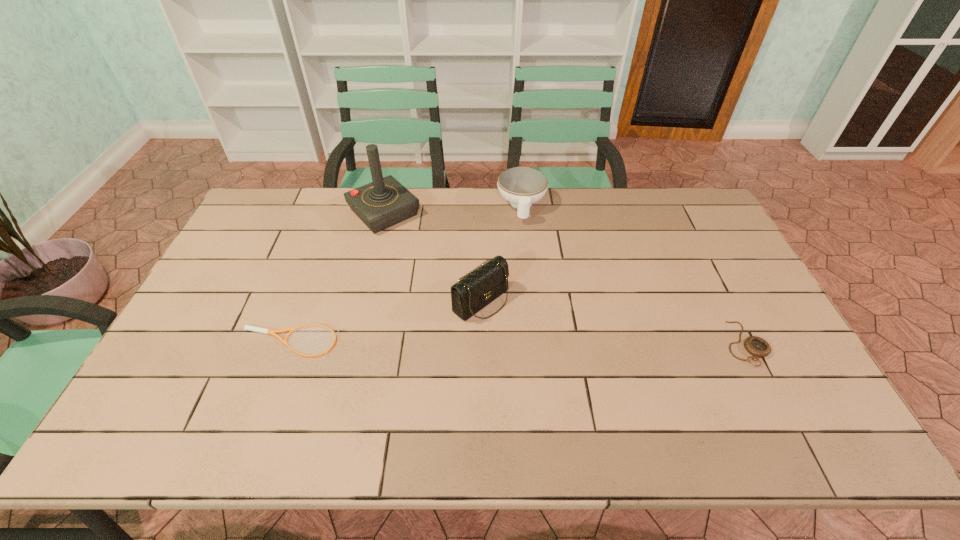
This screenshot has width=960, height=540. I want to click on tennis racket, so click(x=251, y=328).

Find the location of a particular element. The image size is (960, 540). the second shortest object is located at coordinates click(756, 346).

Where is `pocket watch`? The image size is (960, 540). pocket watch is located at coordinates (756, 346).

Locate an element on the screen. Image resolution: width=960 pixels, height=540 pixels. the third shortest object is located at coordinates (521, 186).

Identify the location of the fourth shortest object. (474, 291).

Locate an element on the screen. the tallest object is located at coordinates (385, 202).

Find the location of a particular element. free space located 0.080m on the front of the tennis racket is located at coordinates (272, 388).

Image resolution: width=960 pixels, height=540 pixels. Find the location of `free space located 0.320m on the back of the second shortest object`. free space located 0.320m on the back of the second shortest object is located at coordinates (695, 245).

The image size is (960, 540). Find the location of `vacant region located 0.400m on the side with the handle of the chinaware`. vacant region located 0.400m on the side with the handle of the chinaware is located at coordinates (529, 316).

You are a GUI agent. You are given a task and a screenshot of the screen. Output one action in this format:
    pyautogui.click(x=<x>, y=<y>)
    Task: Click on the vacant space located 0.170m on the side with the handle of the chinaware
    The height and width of the screenshot is (540, 960).
    Given the screenshot: What is the action you would take?
    pyautogui.click(x=525, y=260)